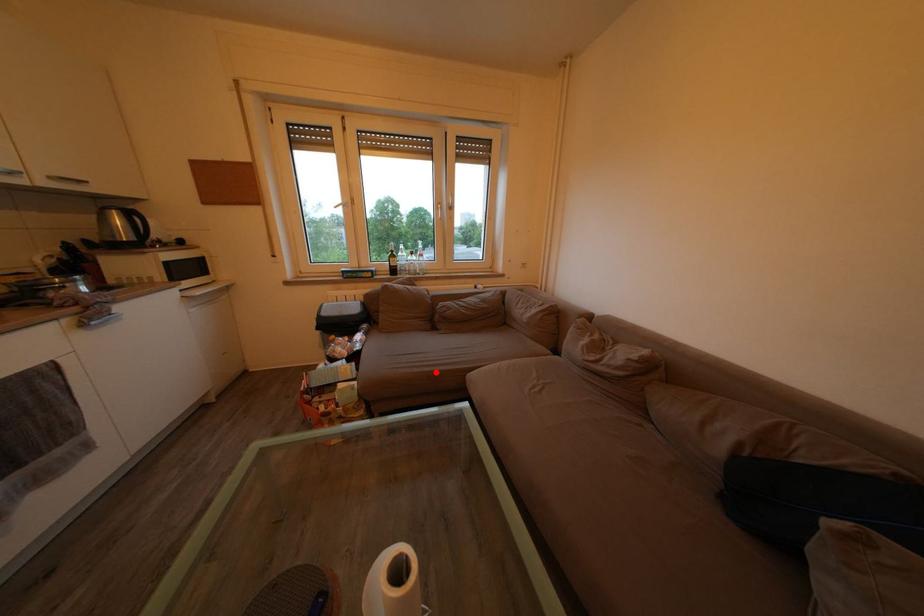
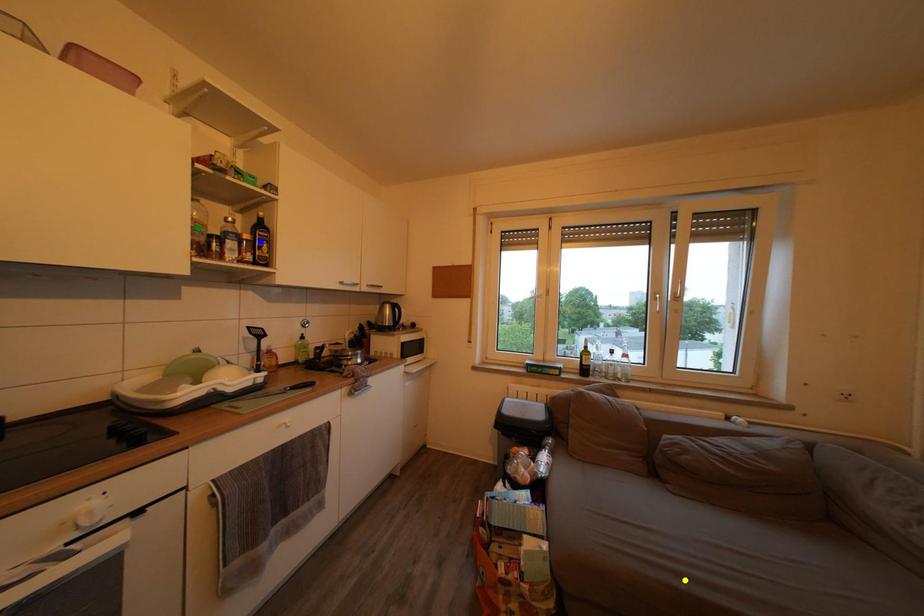
Question: I am providing you with two images of the same scene from different viewpoints. A red point is marked on the first image. You are given multiple points on the second image. Which point in image 2 is actually the same real-world point as the red point in image 1?

Choices:
 (A) green point
 (B) yellow point
 (C) blue point

Answer: (B)